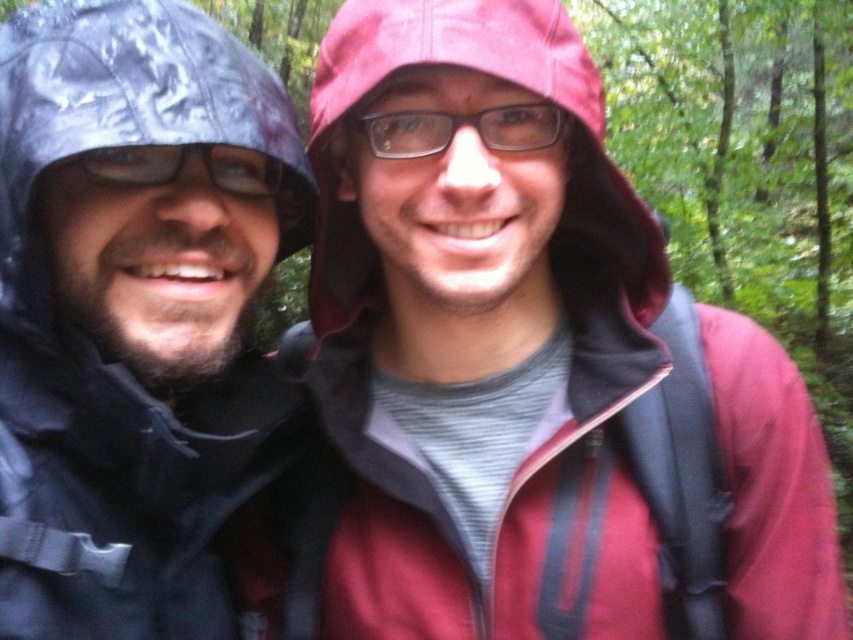
Question: Which object is closer to the camera taking this photo?

Choices:
 (A) clear plastic glasses at center
 (B) matte black jacket at left

Answer: (B)

Question: Does matte black jacket at left appear under clear plastic glasses at center?

Choices:
 (A) no
 (B) yes

Answer: (B)

Question: Can you confirm if matte black jacket at left is thinner than clear plastic glasses at center?

Choices:
 (A) yes
 (B) no

Answer: (B)

Question: Which point appears farthest from the camera in this image?

Choices:
 (A) (556, 129)
 (B) (163, 234)

Answer: (A)

Question: Does matte black jacket at left appear under clear plastic glasses at center?

Choices:
 (A) yes
 (B) no

Answer: (A)